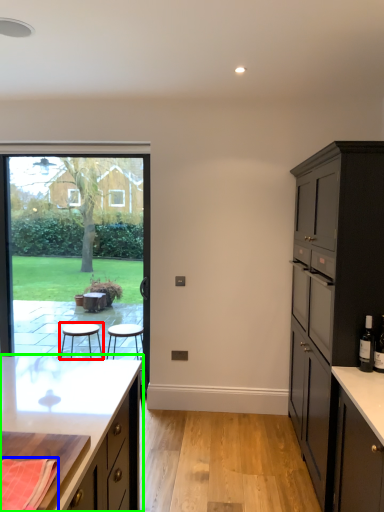
Question: Which object is positioned closest to stool (highlighted by a red box)? Select from material (highlighted by a blue box) and cabinetry (highlighted by a green box).

Choices:
 (A) material
 (B) cabinetry

Answer: (B)